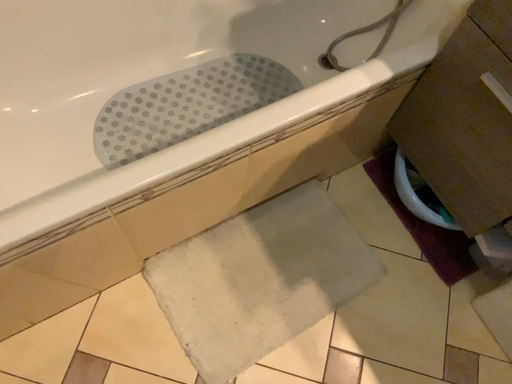
Identify the location of vacant area that is in front of purple fabric bath mat at lower right, positioned as the first bath mat in right-to-left order. This screenshot has width=512, height=384. (415, 307).